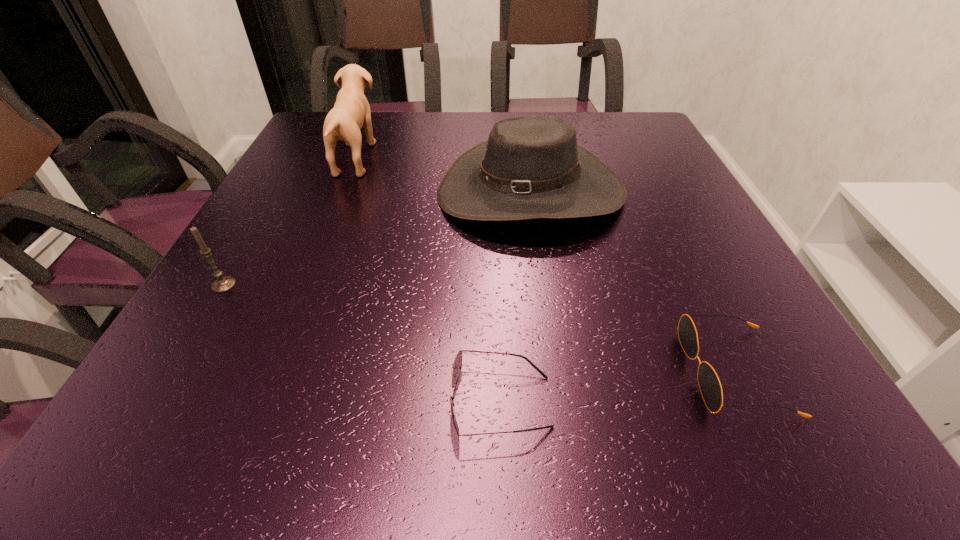
Locate an element on the screen. This screenshot has width=960, height=540. object that can be found as the third closest to the leftmost object is located at coordinates (457, 365).

The height and width of the screenshot is (540, 960). I want to click on free spot that satisfies the following two spatial constraints: 1. on the front-facing side of the cowboy hat; 2. on the front-facing side of the left sunglasses, so click(x=561, y=402).

Where is `free space that satisfies the following two spatial constraints: 1. on the left side of the second object from left to right; 2. on the front side of the third shortest object`? free space that satisfies the following two spatial constraints: 1. on the left side of the second object from left to right; 2. on the front side of the third shortest object is located at coordinates (304, 285).

Find the location of `free space that satisfies the following two spatial constraints: 1. on the left side of the second object from left to right; 2. on the front side of the third nearest object`. free space that satisfies the following two spatial constraints: 1. on the left side of the second object from left to right; 2. on the front side of the third nearest object is located at coordinates [x=304, y=285].